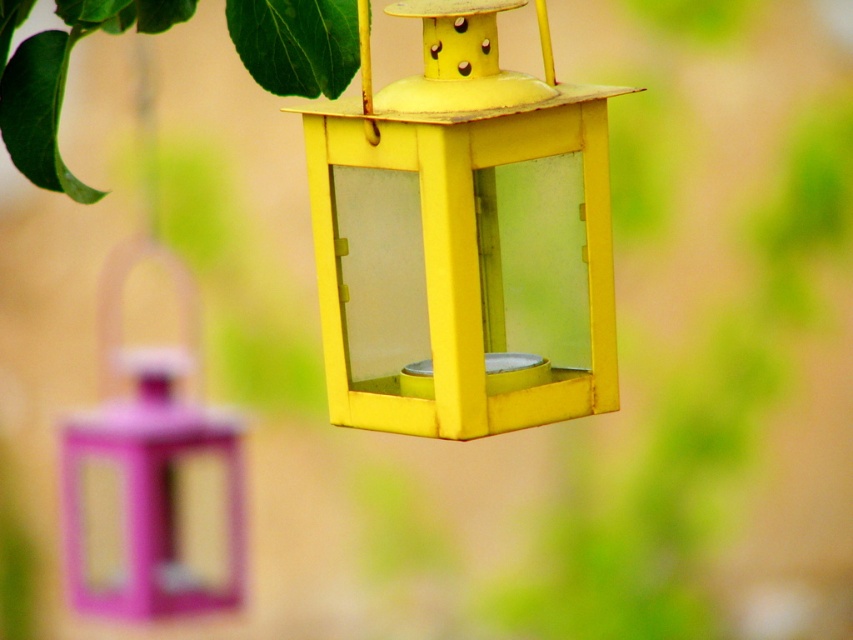
You are a bird that wants to reach the yellow matte lantern at center from the purple matte bird feeder at left. Which direction should you fly to get there?

The yellow matte lantern at center is to the right of the purple matte bird feeder at left, so you should fly to the right.

Looking at this image, you are a bird looking for food. You see the purple matte bird feeder at left and the green matte leaf at upper left. Which one is closer to the ground?

The purple matte bird feeder at left is located below the green matte leaf at upper left, so it is closer to the ground.

You are a bird that wants to fly from the green matte leaf at upper left to the purple matte bird feeder at left. Can you make the jump in one go if your maximum jump distance is 3.5 feet?

The distance between the green matte leaf at upper left and the purple matte bird feeder at left is 3.49 feet, which is just under your maximum jump distance of 3.5 feet. Yes, you can make the jump in one go.